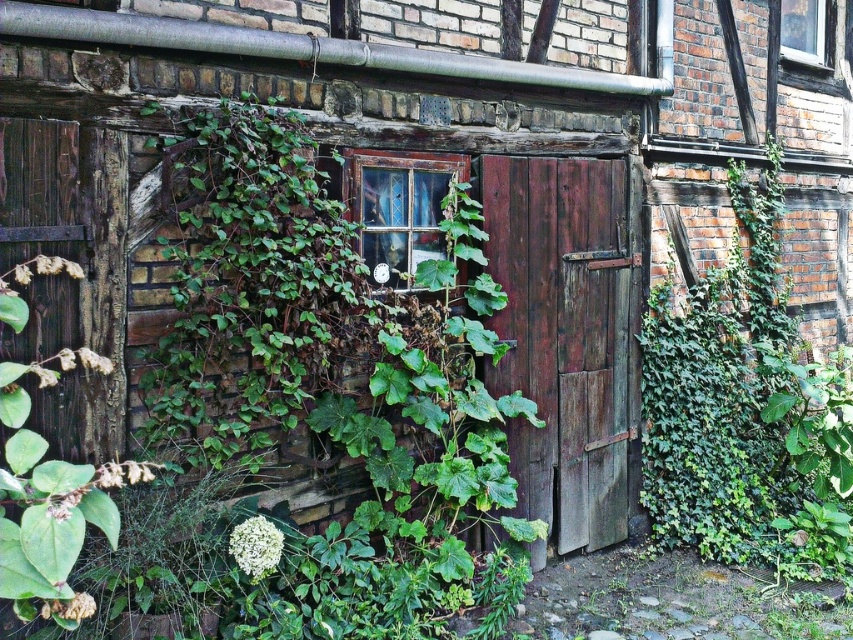
You are an architect inspecting two windows on a historic building. You notice the translucent glass window at center and the clear glass window at upper right. Which window has a greater thickness?

The clear glass window at upper right is thicker than the translucent glass window at center.

You are standing in front of the rustic building and want to enter through the weathered wood door at center. As you approach, can you see the clear glass window at upper right from your current position?

Yes, the weathered wood door at center is in front of the clear glass window at upper right, so you can still see the clear glass window at upper right from your current position.

You are a painter who needs to decide which object to paint first between the weathered wood door at center and the translucent glass window at center. Since you want to paint the taller one first, which one should you choose?

The weathered wood door at center is much taller than the translucent glass window at center, so you should paint the weathered wood door at center first.